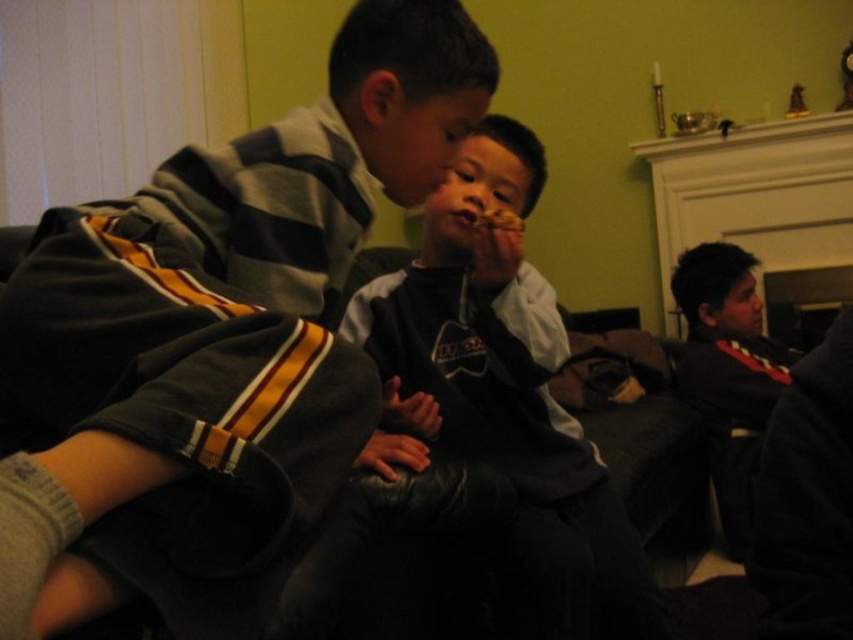
Question: Is metallic silver fireplace at upper right positioned in front of matte brown cookie at center?

Choices:
 (A) yes
 (B) no

Answer: (B)

Question: Based on their relative distances, which object is farther from the metallic silver fireplace at upper right?

Choices:
 (A) matte gray hoodie at center
 (B) matte brown cookie at center

Answer: (A)

Question: Is dark gray hoodie at center wider than metallic silver fireplace at upper right?

Choices:
 (A) yes
 (B) no

Answer: (B)

Question: Which point is farther to the camera?

Choices:
 (A) metallic silver fireplace at upper right
 (B) dark gray sweater at center
 (C) dark gray hoodie at center
 (D) matte gray hoodie at center

Answer: (A)

Question: Does matte gray hoodie at center have a larger size compared to dark gray hoodie at center?

Choices:
 (A) no
 (B) yes

Answer: (A)

Question: Which of the following is the farthest from the observer?

Choices:
 (A) dark gray hoodie at center
 (B) matte gray hoodie at center
 (C) matte brown cookie at center
 (D) metallic silver fireplace at upper right

Answer: (D)